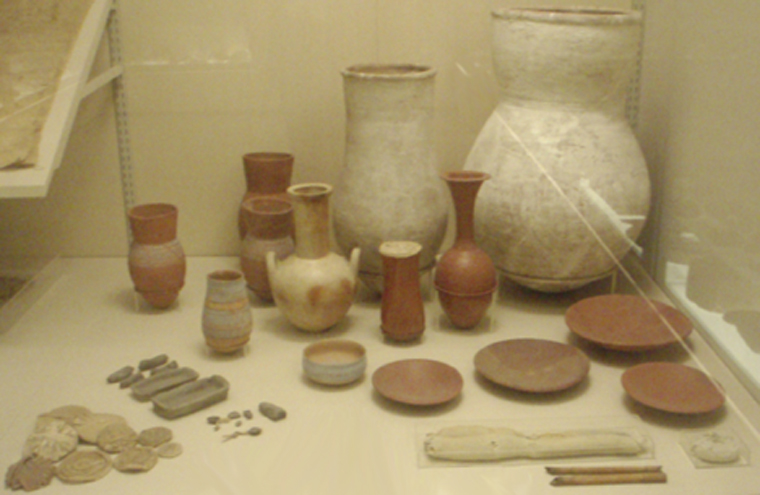
This screenshot has height=495, width=760. Identify the location of vases. (305, 285), (226, 300), (254, 237), (260, 173), (159, 252), (397, 287), (461, 276), (406, 180), (586, 179).